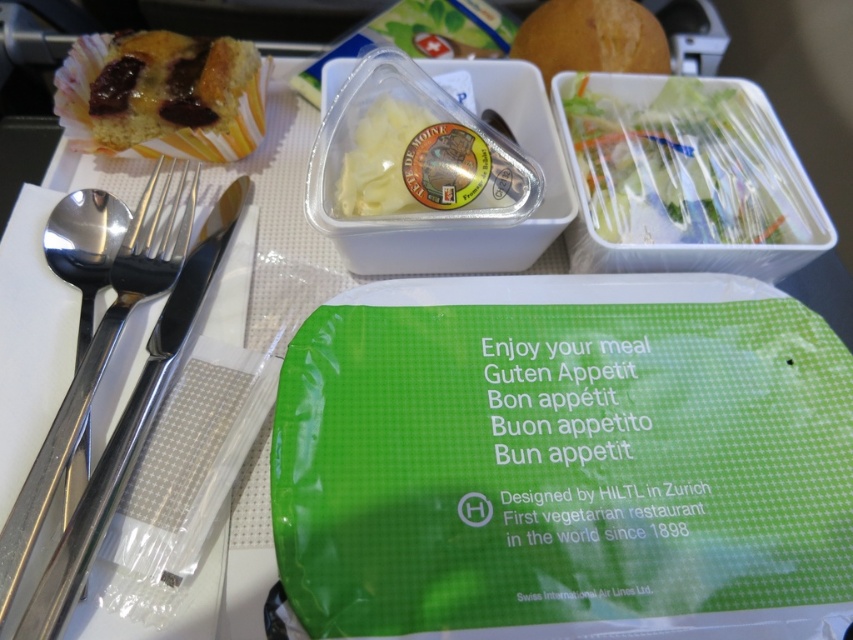
You are a passenger on an airplane and want to reach the salad located at point [798,216] on the meal tray. If your hand can extend 28 inches, will you be able to reach it?

The point [798,216] is 27.45 inches away from the camera, so yes, your hand can reach it since it is within the 28 inch extension range.

You are a passenger on an airplane and want to locate the salad. Where is the translucent plastic salad at upper right relative to the cheese container?

The translucent plastic salad at upper right is located to the right of the cheese container.